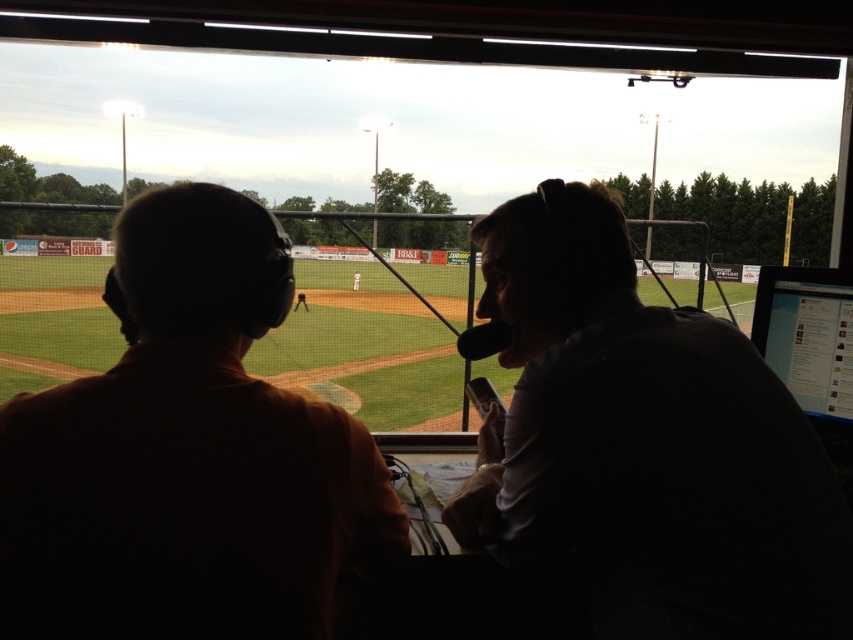
Question: Considering the relative positions of orange cotton shirt at left and black glossy monitor at right in the image provided, where is orange cotton shirt at left located with respect to black glossy monitor at right?

Choices:
 (A) below
 (B) above

Answer: (A)

Question: Which object is farther from the camera taking this photo?

Choices:
 (A) orange cotton shirt at left
 (B) black glossy monitor at right

Answer: (B)

Question: Which of these objects is positioned closest to the orange cotton shirt at left?

Choices:
 (A) black glossy monitor at right
 (B) silhouette shirt at right

Answer: (B)

Question: Is orange cotton shirt at left to the right of black glossy monitor at right from the viewer's perspective?

Choices:
 (A) no
 (B) yes

Answer: (A)

Question: Which object appears farthest from the camera in this image?

Choices:
 (A) silhouette shirt at right
 (B) black glossy monitor at right

Answer: (B)

Question: Does orange cotton shirt at left come in front of silhouette shirt at right?

Choices:
 (A) yes
 (B) no

Answer: (A)